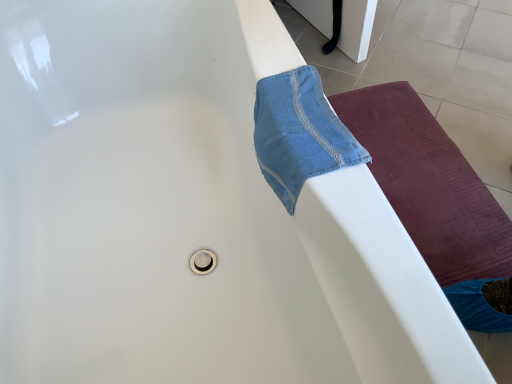
Question: Is blue cotton towel at upper right inside or outside of maroon textured yoga mat at right?

Choices:
 (A) inside
 (B) outside

Answer: (B)

Question: From the image's perspective, is blue cotton towel at upper right positioned above or below maroon textured yoga mat at right?

Choices:
 (A) above
 (B) below

Answer: (A)

Question: In terms of width, does blue cotton towel at upper right look wider or thinner when compared to maroon textured yoga mat at right?

Choices:
 (A) thin
 (B) wide

Answer: (A)

Question: In terms of height, does maroon textured yoga mat at right look taller or shorter compared to blue cotton towel at upper right?

Choices:
 (A) tall
 (B) short

Answer: (A)

Question: Is maroon textured yoga mat at right to the left or to the right of blue cotton towel at upper right in the image?

Choices:
 (A) left
 (B) right

Answer: (B)

Question: From the image's perspective, is maroon textured yoga mat at right positioned above or below blue cotton towel at upper right?

Choices:
 (A) below
 (B) above

Answer: (A)

Question: Considering the positions of point (494, 276) and point (327, 137), is point (494, 276) closer or farther from the camera than point (327, 137)?

Choices:
 (A) closer
 (B) farther

Answer: (B)